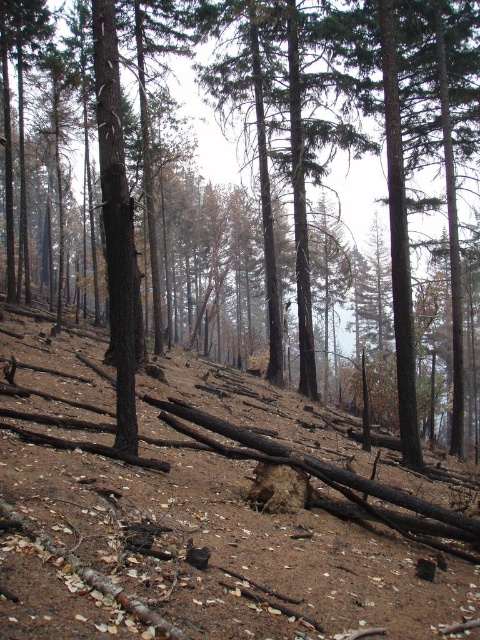
Question: Which of the following is the closest to the observer?

Choices:
 (A) (279, 26)
 (B) (478, 616)

Answer: (B)

Question: Is brown dirt at center positioned before brown wood tree at center?

Choices:
 (A) no
 (B) yes

Answer: (B)

Question: Does brown dirt at center have a greater width compared to brown wood tree at center?

Choices:
 (A) no
 (B) yes

Answer: (A)

Question: Which point is farther from the camera taking this photo?

Choices:
 (A) click(287, 444)
 (B) click(322, 145)

Answer: (B)

Question: Can you confirm if brown dirt at center is positioned to the left of brown wood tree at center?

Choices:
 (A) yes
 (B) no

Answer: (B)

Question: Among these points, which one is nearest to the camera?

Choices:
 (A) (231, 406)
 (B) (404, 321)

Answer: (B)